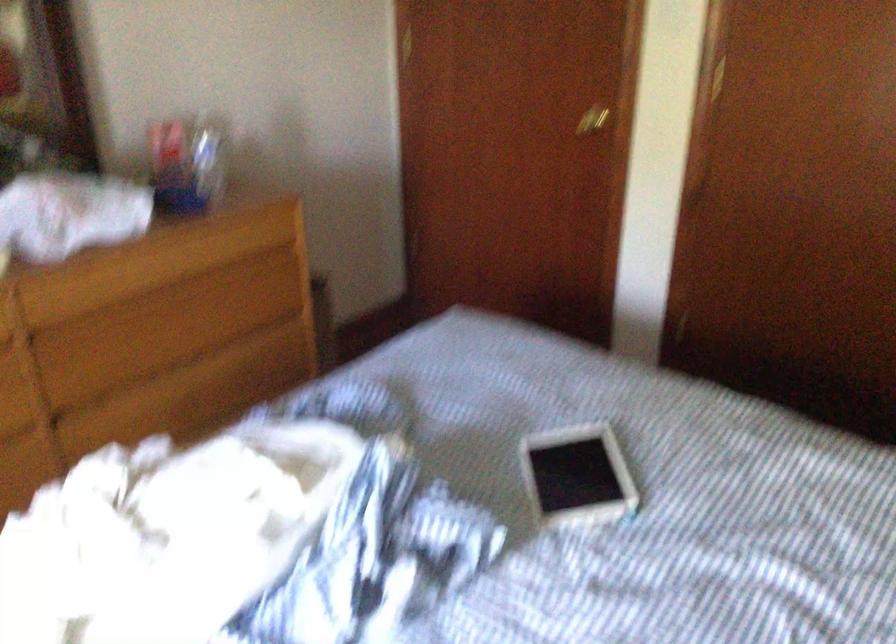
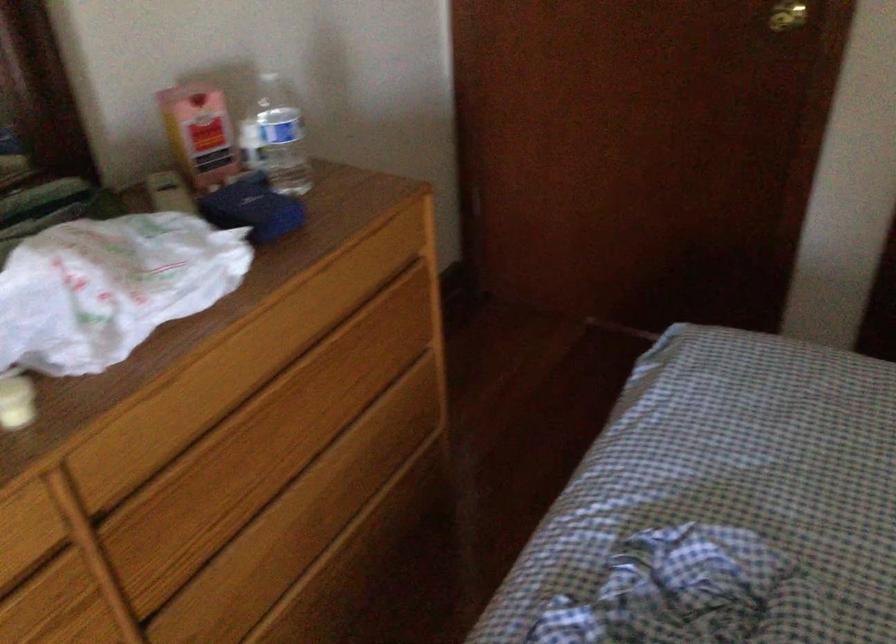
The point at (591,120) is marked in the first image. Where is the corresponding point in the second image?

(787, 15)